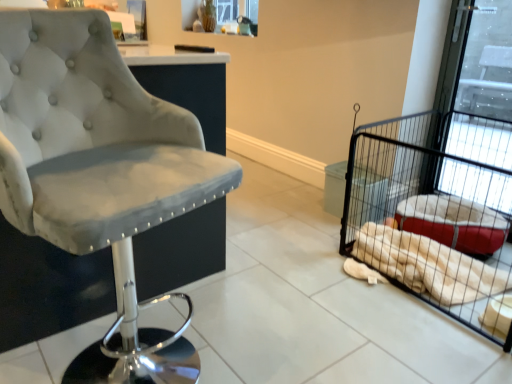
Question: Would you say black wire pet cage at right is outside white plush blanket at right?

Choices:
 (A) no
 (B) yes

Answer: (B)

Question: From a real-world perspective, is black wire pet cage at right below white plush blanket at right?

Choices:
 (A) yes
 (B) no

Answer: (B)

Question: Does black wire pet cage at right have a greater height compared to white plush blanket at right?

Choices:
 (A) yes
 (B) no

Answer: (A)

Question: Considering the relative positions of black wire pet cage at right and white plush blanket at right in the image provided, is black wire pet cage at right in front of white plush blanket at right?

Choices:
 (A) no
 (B) yes

Answer: (B)

Question: Can you confirm if black wire pet cage at right is positioned to the right of white plush blanket at right?

Choices:
 (A) no
 (B) yes

Answer: (B)

Question: Is black wire pet cage at right oriented towards white plush blanket at right?

Choices:
 (A) yes
 (B) no

Answer: (B)

Question: Is velvet grey chair at left turned away from white plush blanket at right?

Choices:
 (A) no
 (B) yes

Answer: (A)

Question: Is velvet grey chair at left smaller than white plush blanket at right?

Choices:
 (A) no
 (B) yes

Answer: (A)

Question: Can you confirm if velvet grey chair at left is bigger than white plush blanket at right?

Choices:
 (A) no
 (B) yes

Answer: (B)

Question: Does velvet grey chair at left have a lesser width compared to white plush blanket at right?

Choices:
 (A) yes
 (B) no

Answer: (B)

Question: Is velvet grey chair at left oriented towards white plush blanket at right?

Choices:
 (A) no
 (B) yes

Answer: (A)

Question: Is velvet grey chair at left wider than white plush blanket at right?

Choices:
 (A) yes
 (B) no

Answer: (A)

Question: Is white plush blanket at right to the left of black wire pet cage at right from the viewer's perspective?

Choices:
 (A) no
 (B) yes

Answer: (B)